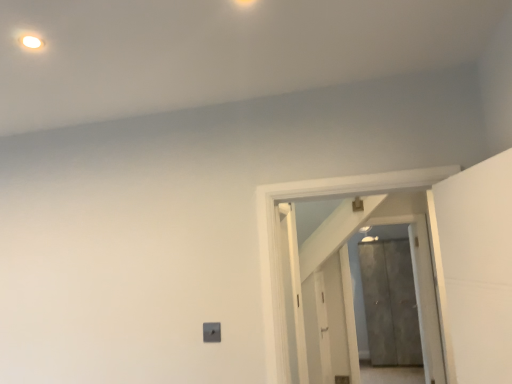
Question: Considering the relative positions of white wooden door at center, acting as the 1th door starting from the front, and metallic gray door at center, which is counted as the second door, starting from the front, in the image provided, is white wooden door at center, acting as the 1th door starting from the front, to the left or to the right of metallic gray door at center, which is counted as the second door, starting from the front,?

Choices:
 (A) right
 (B) left

Answer: (B)

Question: From a real-world perspective, is white wooden door at center, acting as the first door starting from the top, positioned above or below metallic gray door at center, acting as the 1th door starting from the bottom?

Choices:
 (A) below
 (B) above

Answer: (B)

Question: From the image's perspective, is white wooden door at center, which is counted as the 2th door, starting from the right, located above or below metallic gray door at center, which is counted as the second door, starting from the front?

Choices:
 (A) below
 (B) above

Answer: (B)

Question: Which is correct: metallic gray door at center, which is counted as the second door, starting from the front, is inside white wooden door at center, acting as the first door starting from the top, or outside of it?

Choices:
 (A) inside
 (B) outside

Answer: (B)

Question: Looking at their shapes, would you say metallic gray door at center, acting as the 1th door starting from the bottom, is wider or thinner than white wooden door at center, acting as the first door starting from the top?

Choices:
 (A) wide
 (B) thin

Answer: (A)

Question: From a real-world perspective, is metallic gray door at center, acting as the 1th door starting from the back, physically located above or below white wooden door at center, acting as the first door starting from the top?

Choices:
 (A) above
 (B) below

Answer: (B)

Question: Considering the positions of metallic gray door at center, acting as the 1th door starting from the back, and white wooden door at center, marked as the second door in a bottom-to-top arrangement, in the image, is metallic gray door at center, acting as the 1th door starting from the back, taller or shorter than white wooden door at center, marked as the second door in a bottom-to-top arrangement,?

Choices:
 (A) short
 (B) tall

Answer: (B)